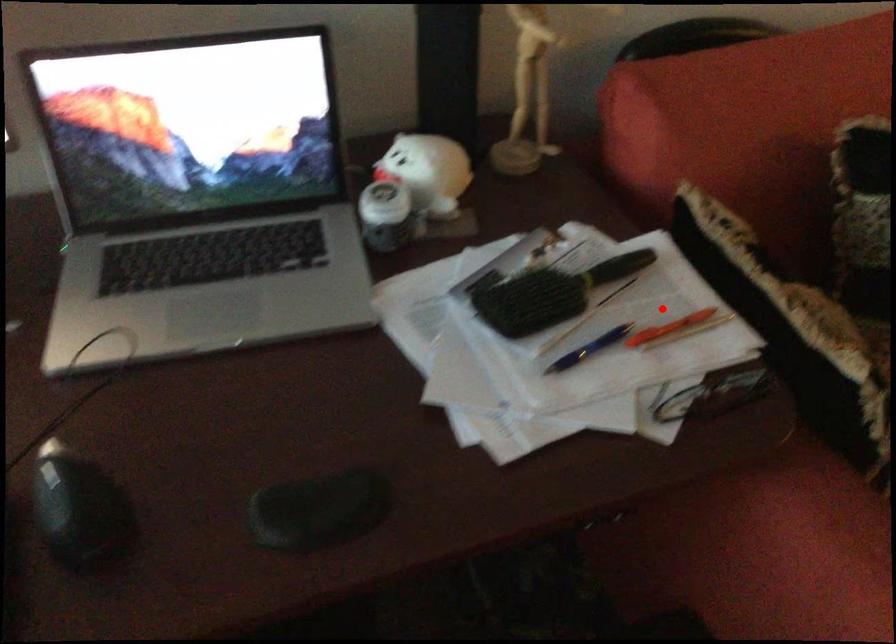
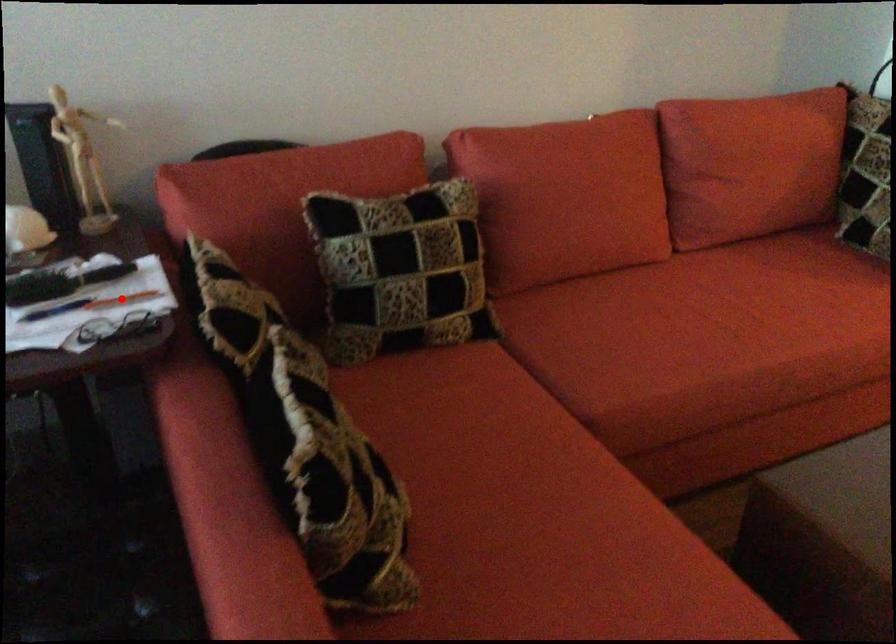
I am providing you with two images of the same scene from different viewpoints. A red point is marked on the first image and another point is marked on the second image. Are the points marked in image1 and image2 representing the same 3D position?

Yes